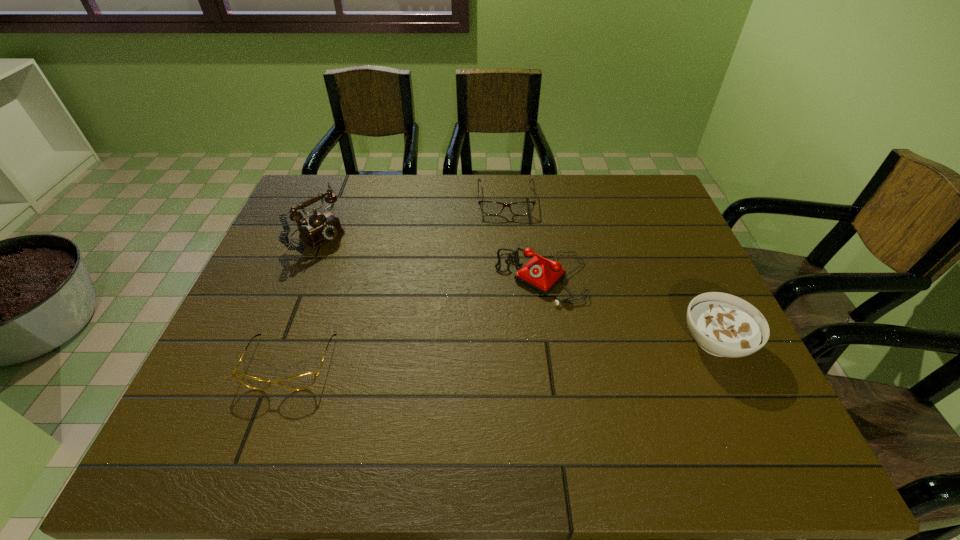
Find the location of a particular element. This screenshot has width=960, height=540. the fourth closest object to the right spectacles is located at coordinates (302, 381).

This screenshot has width=960, height=540. What are the coordinates of `object that is the fourth closest to the left telephone` in the screenshot? It's located at (724, 325).